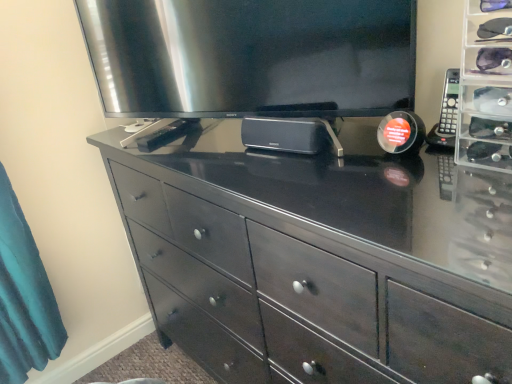
Question: Should I look upward or downward to see black plastic remote at right?

Choices:
 (A) up
 (B) down

Answer: (A)

Question: Is dark wood dresser at center next to satin silver television at upper center and touching it?

Choices:
 (A) no
 (B) yes

Answer: (A)

Question: Is dark wood dresser at center oriented towards satin silver television at upper center?

Choices:
 (A) yes
 (B) no

Answer: (B)

Question: Considering the relative sizes of dark wood dresser at center and satin silver television at upper center in the image provided, is dark wood dresser at center smaller than satin silver television at upper center?

Choices:
 (A) no
 (B) yes

Answer: (A)

Question: Is dark wood dresser at center outside of satin silver television at upper center?

Choices:
 (A) no
 (B) yes

Answer: (B)

Question: From a real-world perspective, is dark wood dresser at center on top of satin silver television at upper center?

Choices:
 (A) yes
 (B) no

Answer: (B)

Question: From the image's perspective, is dark wood dresser at center located beneath satin silver television at upper center?

Choices:
 (A) yes
 (B) no

Answer: (A)

Question: Is dark wood dresser at center completely or partially inside satin silver television at upper center?

Choices:
 (A) yes
 (B) no

Answer: (B)

Question: Is satin silver television at upper center positioned with its back to dark wood dresser at center?

Choices:
 (A) no
 (B) yes

Answer: (A)

Question: Is satin silver television at upper center facing towards dark wood dresser at center?

Choices:
 (A) yes
 (B) no

Answer: (B)

Question: From the image's perspective, is satin silver television at upper center on top of dark wood dresser at center?

Choices:
 (A) no
 (B) yes

Answer: (B)

Question: Considering the relative positions of satin silver television at upper center and dark wood dresser at center in the image provided, is satin silver television at upper center behind dark wood dresser at center?

Choices:
 (A) yes
 (B) no

Answer: (A)

Question: Is the surface of satin silver television at upper center in direct contact with dark wood dresser at center?

Choices:
 (A) yes
 (B) no

Answer: (B)

Question: Considering the relative positions of satin silver television at upper center and black plastic remote at right in the image provided, is satin silver television at upper center behind black plastic remote at right?

Choices:
 (A) yes
 (B) no

Answer: (B)